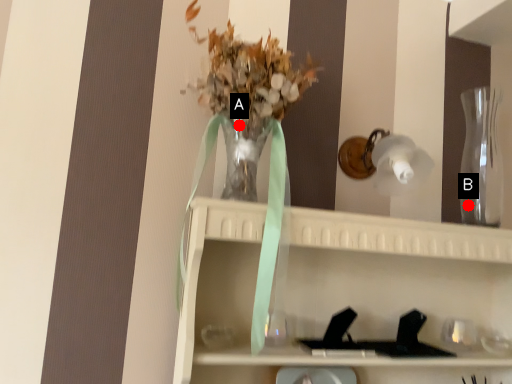
Question: Two points are circled on the image, labeled by A and B beside each circle. Which point is further to the camera?

Choices:
 (A) A is further
 (B) B is further

Answer: (B)